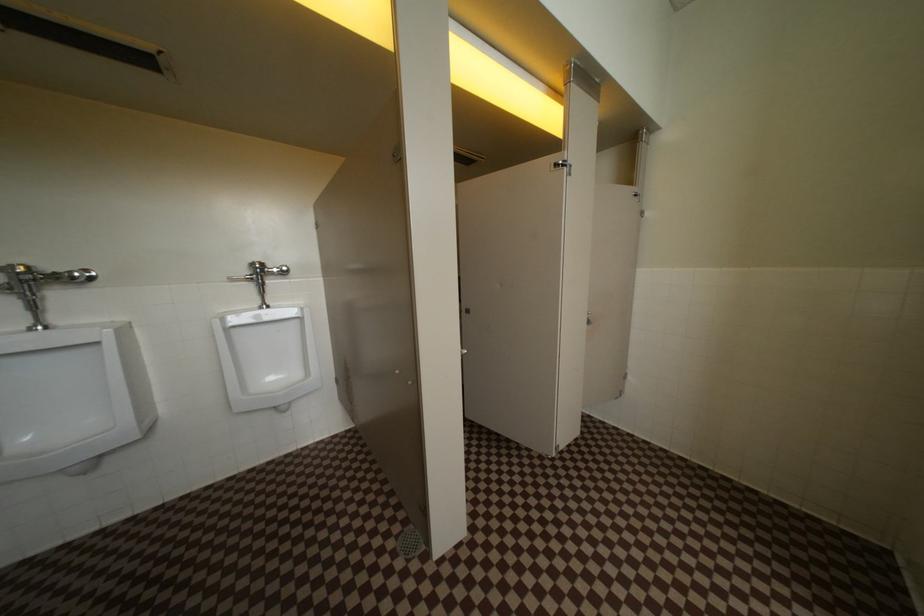
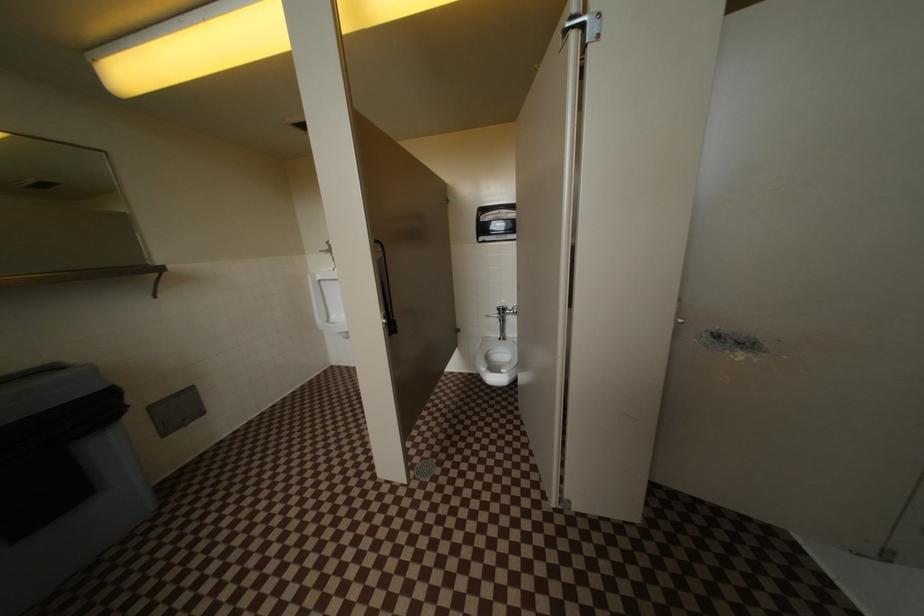
Question: The first image is from the beginning of the video and the second image is from the end. How did the camera likely rotate when shooting the video?

Choices:
 (A) Left
 (B) Right
 (C) Up
 (D) Down

Answer: (A)